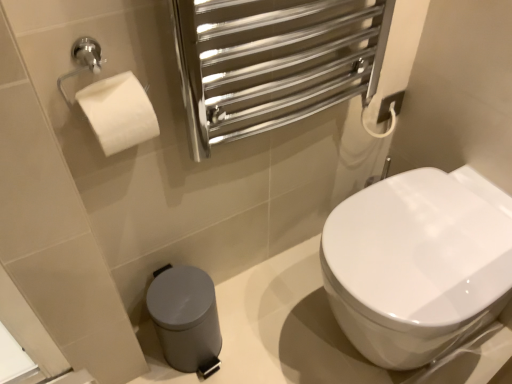
This screenshot has height=384, width=512. Identify the location of white glossy toilet at center. (417, 264).

The width and height of the screenshot is (512, 384). What do you see at coordinates (417, 264) in the screenshot?
I see `white glossy toilet at center` at bounding box center [417, 264].

At what (x,y) coordinates should I click in order to perform the action: click on satin grey plastic trash can at lower left. Please return your answer as a coordinate pair (x, y). The image size is (512, 384). Looking at the image, I should click on (185, 317).

The image size is (512, 384). Describe the element at coordinates (185, 317) in the screenshot. I see `satin grey plastic trash can at lower left` at that location.

Find the location of a particular element. Image resolution: width=512 pixels, height=384 pixels. white glossy toilet at center is located at coordinates (417, 264).

Considering the relative positions of white glossy toilet at center and satin grey plastic trash can at lower left in the image provided, is white glossy toilet at center to the left of satin grey plastic trash can at lower left from the viewer's perspective?

No.

Considering the positions of objects white glossy toilet at center and satin grey plastic trash can at lower left in the image provided, who is behind, white glossy toilet at center or satin grey plastic trash can at lower left?

satin grey plastic trash can at lower left is further away from the camera.

Is point (390, 242) closer or farther from the camera than point (184, 365)?

Point (390, 242).

From the image's perspective, which is below, white glossy toilet at center or satin grey plastic trash can at lower left?

satin grey plastic trash can at lower left.

From a real-world perspective, relative to satin grey plastic trash can at lower left, is white glossy toilet at center vertically above or below?

From a real-world perspective, white glossy toilet at center is physically above satin grey plastic trash can at lower left.

Between white glossy toilet at center and satin grey plastic trash can at lower left, which one has smaller width?

Thinner between the two is satin grey plastic trash can at lower left.

From their relative heights in the image, would you say white glossy toilet at center is taller or shorter than satin grey plastic trash can at lower left?

Considering their sizes, white glossy toilet at center has more height than satin grey plastic trash can at lower left.

Does white glossy toilet at center have a smaller size compared to satin grey plastic trash can at lower left?

Actually, white glossy toilet at center might be larger than satin grey plastic trash can at lower left.

Is white glossy toilet at center located outside satin grey plastic trash can at lower left?

Yes.

Is white glossy toilet at center not near satin grey plastic trash can at lower left?

white glossy toilet at center is near satin grey plastic trash can at lower left, not far away.

Could you tell me if white glossy toilet at center is turned towards satin grey plastic trash can at lower left?

Yes, white glossy toilet at center is oriented towards satin grey plastic trash can at lower left.

How different are the orientations of white glossy toilet at center and satin grey plastic trash can at lower left in degrees?

They differ by 89.5 degrees in their facing directions.

Where is `porcelain located underneath the white glossy toilet at center (from a real-world perspective)`? The width and height of the screenshot is (512, 384). porcelain located underneath the white glossy toilet at center (from a real-world perspective) is located at coordinates (185, 317).

Can you confirm if satin grey plastic trash can at lower left is positioned to the right of white glossy toilet at center?

No.

Who is more distant, satin grey plastic trash can at lower left or white glossy toilet at center?

Positioned behind is satin grey plastic trash can at lower left.

Between point (202, 286) and point (411, 337), which one is positioned behind?

The point (202, 286) is farther from the camera.

From the image's perspective, who appears lower, satin grey plastic trash can at lower left or white glossy toilet at center?

From the image's view, satin grey plastic trash can at lower left is below.

From a real-world perspective, which object rests below the other?

satin grey plastic trash can at lower left, from a real-world perspective.

Which object is wider, satin grey plastic trash can at lower left or white glossy toilet at center?

white glossy toilet at center is wider.

Who is taller, satin grey plastic trash can at lower left or white glossy toilet at center?

Standing taller between the two is white glossy toilet at center.

Can you confirm if satin grey plastic trash can at lower left is bigger than white glossy toilet at center?

No, satin grey plastic trash can at lower left is not bigger than white glossy toilet at center.

Could white glossy toilet at center be considered to be inside satin grey plastic trash can at lower left?

No, white glossy toilet at center is not inside satin grey plastic trash can at lower left.

Are satin grey plastic trash can at lower left and white glossy toilet at center far apart?

Actually, satin grey plastic trash can at lower left and white glossy toilet at center are a little close together.

Consider the image. Could you tell me if satin grey plastic trash can at lower left is turned towards white glossy toilet at center?

No, satin grey plastic trash can at lower left is not oriented towards white glossy toilet at center.

The image size is (512, 384). I want to click on porcelain located below the white glossy toilet at center (from the image's perspective), so click(185, 317).

The image size is (512, 384). Find the location of `toilet in front of the satin grey plastic trash can at lower left`. toilet in front of the satin grey plastic trash can at lower left is located at coordinates (417, 264).

The width and height of the screenshot is (512, 384). What are the coordinates of `porcelain below the white glossy toilet at center (from the image's perspective)` in the screenshot? It's located at (185, 317).